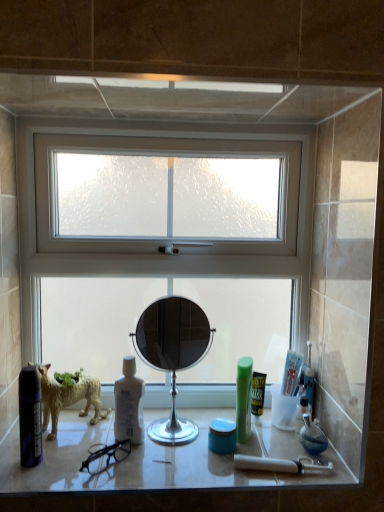
Locate an element on the screen. The image size is (384, 512). vacant space that is in between matte black can at left and blue matte jar at center, the second mouthwash positioned from the left is located at coordinates (136, 454).